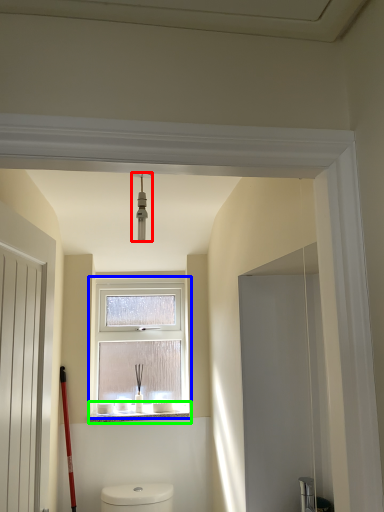
Question: Considering the real-world distances, which object is farthest from light fixture (highlighted by a red box)? window (highlighted by a blue box) or window sill (highlighted by a green box)?

Choices:
 (A) window
 (B) window sill

Answer: (B)